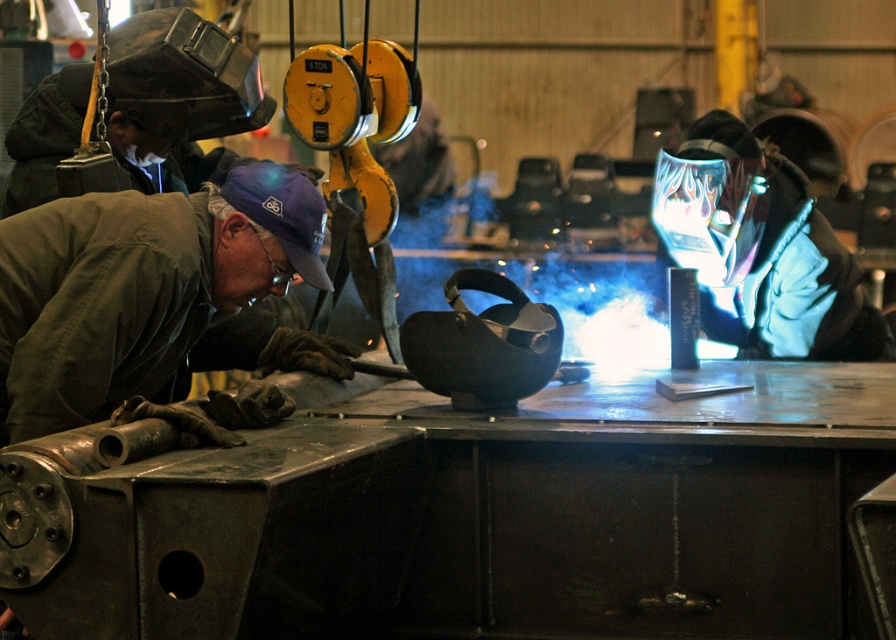
Question: Is green matte jacket at left wider than shiny chrome helmet at center?

Choices:
 (A) yes
 (B) no

Answer: (B)

Question: Does green matte jacket at left come in front of shiny chrome helmet at center?

Choices:
 (A) yes
 (B) no

Answer: (A)

Question: Is green matte jacket at left to the right of shiny chrome helmet at center from the viewer's perspective?

Choices:
 (A) yes
 (B) no

Answer: (B)